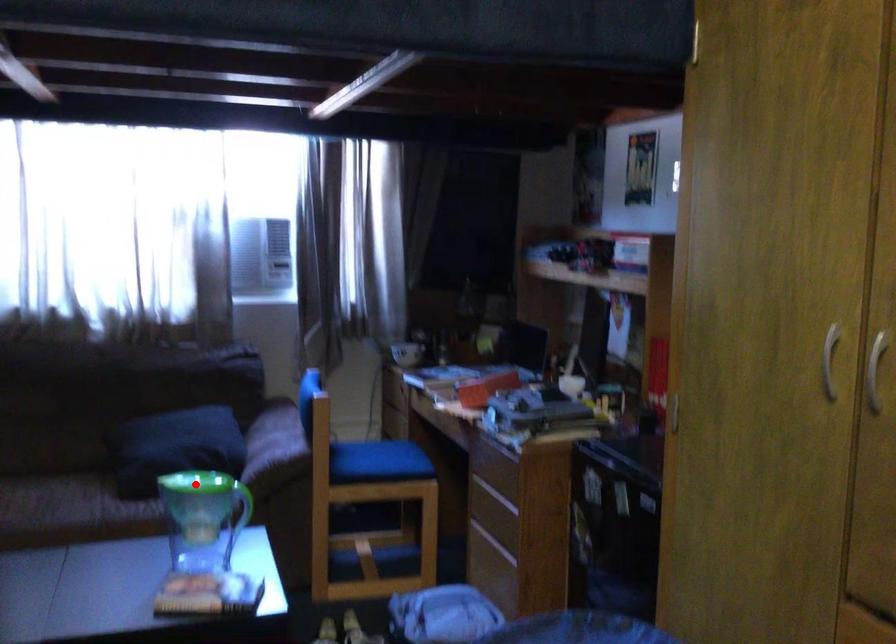
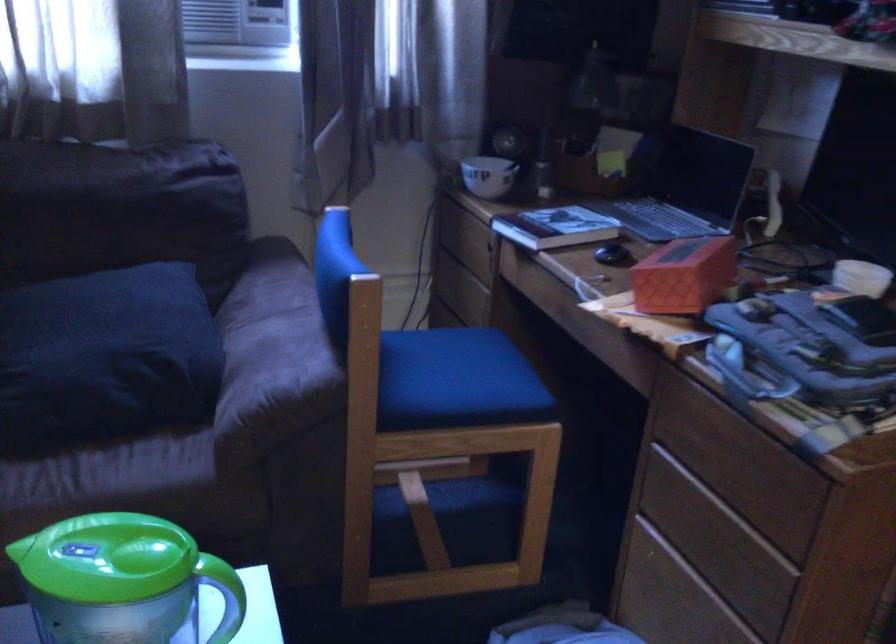
Find the pixel in the second image that matches the highlighted location in the first image.

(106, 558)